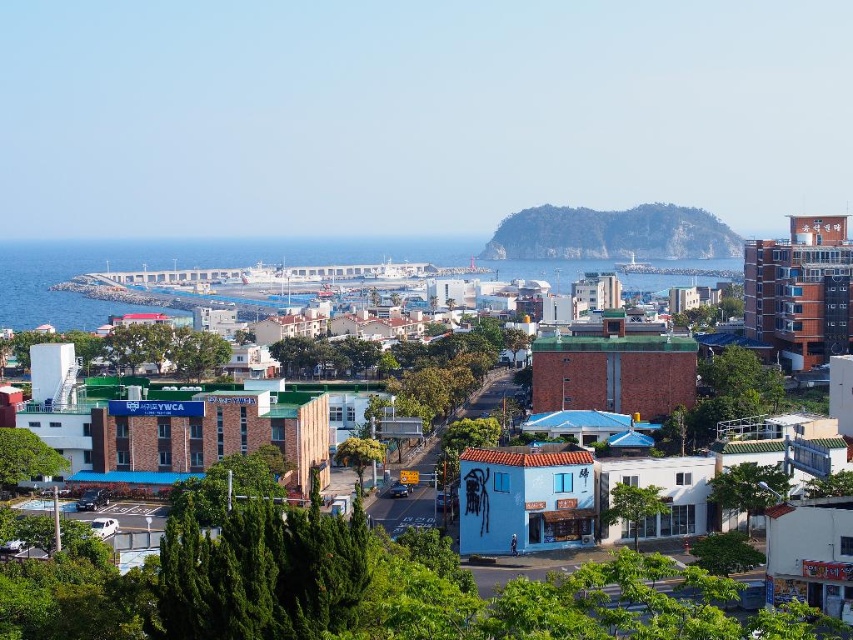
Question: Considering the real-world distances, which object is farthest from the green rocky island at center?

Choices:
 (A) blue concrete water at center
 (B) brown brick building at center

Answer: (B)

Question: Which of the following is the farthest from the observer?

Choices:
 (A) pos(634,493)
 (B) pos(283,250)

Answer: (B)

Question: Is blue concrete water at center above green rocky island at center?

Choices:
 (A) no
 (B) yes

Answer: (A)

Question: Where is brown brick building at center located in relation to green rocky island at center in the image?

Choices:
 (A) right
 (B) left

Answer: (B)

Question: From the image, what is the correct spatial relationship of brown brick building at center in relation to green rocky island at center?

Choices:
 (A) below
 (B) above

Answer: (A)

Question: Which is farther from the green rocky island at center?

Choices:
 (A) blue concrete water at center
 (B) brown brick building at center

Answer: (B)